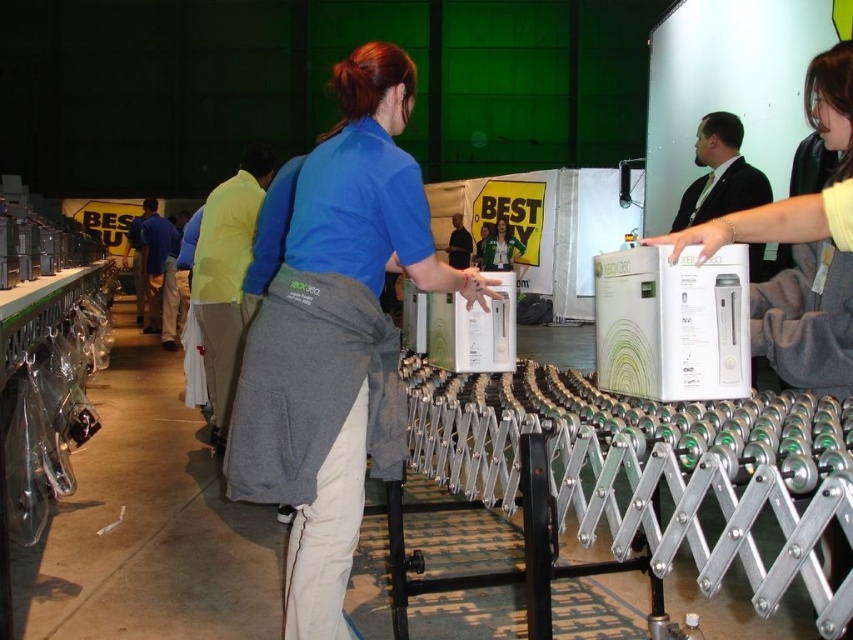
Question: Is the position of blue fabric shirt at center less distant than that of green fabric jacket at center?

Choices:
 (A) yes
 (B) no

Answer: (A)

Question: Which point is farther to the camera?

Choices:
 (A) blue fabric shirt at center
 (B) green fabric jacket at center

Answer: (B)

Question: Which of the following is the closest to the observer?

Choices:
 (A) blue fabric shirt at center
 (B) green fabric jacket at center

Answer: (A)

Question: Is blue fabric shirt at center below green fabric jacket at center?

Choices:
 (A) yes
 (B) no

Answer: (A)

Question: Can you confirm if blue fabric shirt at center is positioned to the left of green fabric jacket at center?

Choices:
 (A) yes
 (B) no

Answer: (A)

Question: Which object is farther from the camera taking this photo?

Choices:
 (A) green fabric jacket at center
 (B) blue fabric shirt at center

Answer: (A)